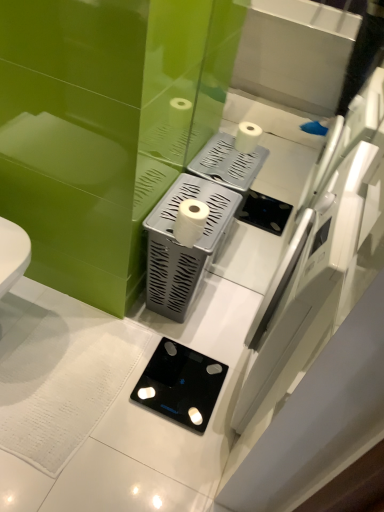
Where is `vacant point to the right of silver textured tissue holder at center`? The height and width of the screenshot is (512, 384). vacant point to the right of silver textured tissue holder at center is located at coordinates (227, 311).